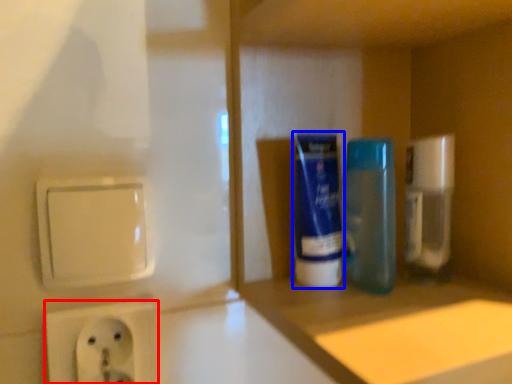
Question: Which of the following is the farthest to the observer, power plugs and sockets (highlighted by a red box) or mouthwash (highlighted by a blue box)?

Choices:
 (A) power plugs and sockets
 (B) mouthwash

Answer: (B)